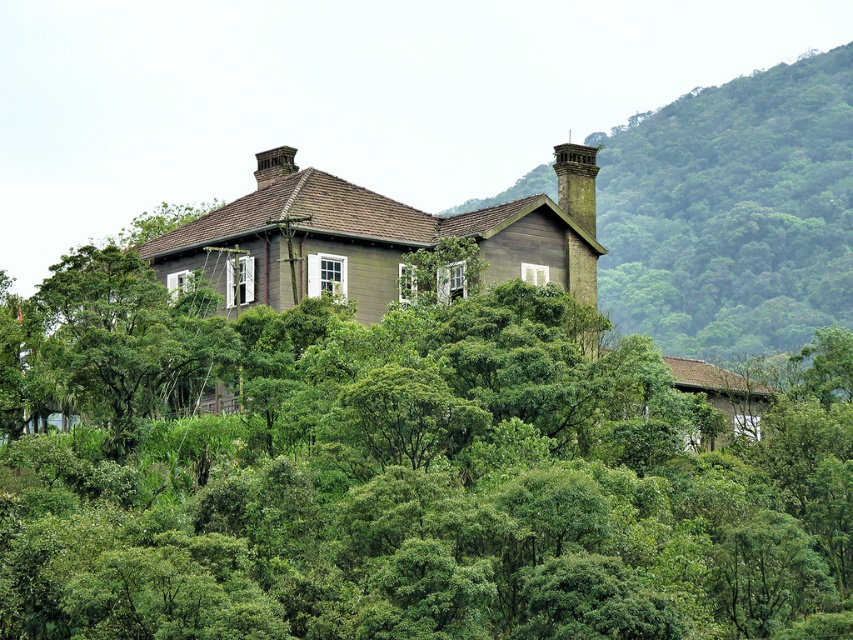
Question: Does green leafy tree at center have a greater width compared to wooden house at center?

Choices:
 (A) yes
 (B) no

Answer: (B)

Question: Estimate the real-world distances between objects in this image. Which object is farther from the green leafy tree at center?

Choices:
 (A) wooden house at center
 (B) rustic stone chimney at upper right

Answer: (A)

Question: Is wooden house at center wider than rustic stone chimney at upper right?

Choices:
 (A) yes
 (B) no

Answer: (A)

Question: Does wooden house at center lie in front of rustic stone chimney at upper right?

Choices:
 (A) yes
 (B) no

Answer: (B)

Question: Which object is farther from the camera taking this photo?

Choices:
 (A) wooden house at center
 (B) green leafy tree at center
 (C) rustic stone chimney at upper right

Answer: (A)

Question: Which point is closer to the camera?

Choices:
 (A) rustic stone chimney at upper right
 (B) green leafy tree at center
 (C) wooden house at center

Answer: (B)